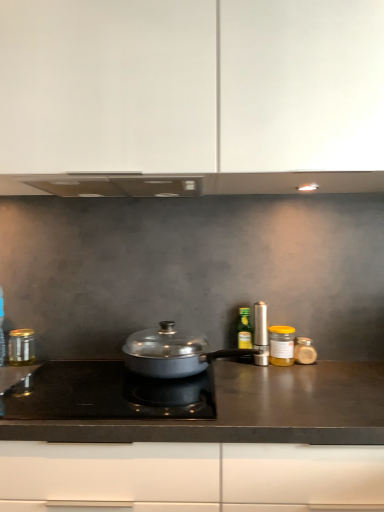
Question: Would you say translucent glass jar at right, which is the first kitchen appliance in right-to-left order, is part of white matte cabinet at upper center's contents?

Choices:
 (A) yes
 (B) no

Answer: (B)

Question: Does white matte cabinet at upper center have a greater height compared to translucent glass jar at right, which is the first kitchen appliance in right-to-left order?

Choices:
 (A) no
 (B) yes

Answer: (B)

Question: Can you confirm if white matte cabinet at upper center is positioned to the left of translucent glass jar at right, acting as the 6th kitchen appliance starting from the left?

Choices:
 (A) no
 (B) yes

Answer: (B)

Question: From a real-world perspective, is white matte cabinet at upper center on translucent glass jar at right, acting as the 6th kitchen appliance starting from the left?

Choices:
 (A) no
 (B) yes

Answer: (B)

Question: Is white matte cabinet at upper center further to camera compared to translucent glass jar at right, acting as the 6th kitchen appliance starting from the left?

Choices:
 (A) yes
 (B) no

Answer: (B)

Question: In the image, is metallic silver canister at center right, marked as the third kitchen appliance in a left-to-right arrangement, positioned in front of or behind white matte cabinet at upper center?

Choices:
 (A) front
 (B) behind

Answer: (B)

Question: From a real-world perspective, is metallic silver canister at center right, marked as the third kitchen appliance in a left-to-right arrangement, above or below white matte cabinet at upper center?

Choices:
 (A) above
 (B) below

Answer: (B)

Question: Is point (238, 327) closer or farther from the camera than point (360, 133)?

Choices:
 (A) closer
 (B) farther

Answer: (B)

Question: Looking at the image, does metallic silver canister at center right, which is the fourth kitchen appliance in right-to-left order, seem bigger or smaller compared to white matte cabinet at upper center?

Choices:
 (A) big
 (B) small

Answer: (B)

Question: Is black glass cooktop at center taller or shorter than metallic silver canister at center right, marked as the third kitchen appliance in a left-to-right arrangement?

Choices:
 (A) tall
 (B) short

Answer: (B)

Question: From the image's perspective, is black glass cooktop at center positioned above or below metallic silver canister at center right, marked as the third kitchen appliance in a left-to-right arrangement?

Choices:
 (A) above
 (B) below

Answer: (B)

Question: Is black glass cooktop at center in front of or behind metallic silver canister at center right, marked as the third kitchen appliance in a left-to-right arrangement, in the image?

Choices:
 (A) behind
 (B) front

Answer: (B)

Question: Considering the positions of point (115, 384) and point (243, 324), is point (115, 384) closer or farther from the camera than point (243, 324)?

Choices:
 (A) farther
 (B) closer

Answer: (B)

Question: Looking at the image, does black matte countertop at center seem bigger or smaller compared to yellow glass jar at right, marked as the second kitchen appliance in a right-to-left arrangement?

Choices:
 (A) big
 (B) small

Answer: (A)

Question: Considering their positions, is black matte countertop at center located in front of or behind yellow glass jar at right, marked as the second kitchen appliance in a right-to-left arrangement?

Choices:
 (A) front
 (B) behind

Answer: (A)